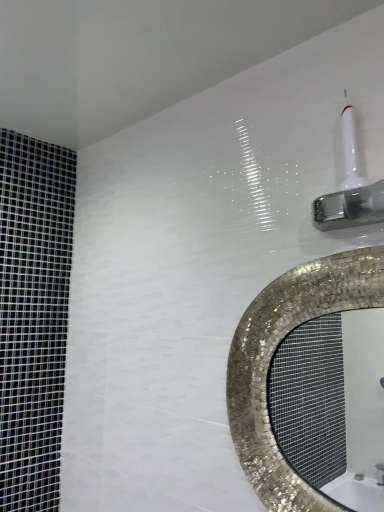
Question: Is shiny mosaic mirror at upper right oriented away from white glossy shower head at upper right?

Choices:
 (A) no
 (B) yes

Answer: (A)

Question: Is shiny mosaic mirror at upper right further to the viewer compared to white glossy shower head at upper right?

Choices:
 (A) no
 (B) yes

Answer: (B)

Question: From a real-world perspective, is shiny mosaic mirror at upper right beneath white glossy shower head at upper right?

Choices:
 (A) yes
 (B) no

Answer: (A)

Question: Considering the relative sizes of shiny mosaic mirror at upper right and white glossy shower head at upper right in the image provided, is shiny mosaic mirror at upper right wider than white glossy shower head at upper right?

Choices:
 (A) yes
 (B) no

Answer: (B)

Question: Is shiny mosaic mirror at upper right smaller than white glossy shower head at upper right?

Choices:
 (A) yes
 (B) no

Answer: (B)

Question: Is shiny mosaic mirror at upper right aimed at white glossy shower head at upper right?

Choices:
 (A) yes
 (B) no

Answer: (B)

Question: Is white glossy shower head at upper right facing towards shiny mosaic mirror at upper right?

Choices:
 (A) no
 (B) yes

Answer: (A)

Question: From the image's perspective, does white glossy shower head at upper right appear lower than shiny mosaic mirror at upper right?

Choices:
 (A) yes
 (B) no

Answer: (B)

Question: Does white glossy shower head at upper right appear on the left side of shiny mosaic mirror at upper right?

Choices:
 (A) yes
 (B) no

Answer: (B)

Question: Is white glossy shower head at upper right not near shiny mosaic mirror at upper right?

Choices:
 (A) yes
 (B) no

Answer: (A)

Question: Considering the relative sizes of white glossy shower head at upper right and shiny mosaic mirror at upper right in the image provided, is white glossy shower head at upper right wider than shiny mosaic mirror at upper right?

Choices:
 (A) yes
 (B) no

Answer: (A)

Question: Is shiny mosaic mirror at upper right at the back of white glossy shower head at upper right?

Choices:
 (A) no
 (B) yes

Answer: (A)

Question: In terms of width, does shiny mosaic mirror at upper right look wider or thinner when compared to white glossy shower head at upper right?

Choices:
 (A) wide
 (B) thin

Answer: (B)